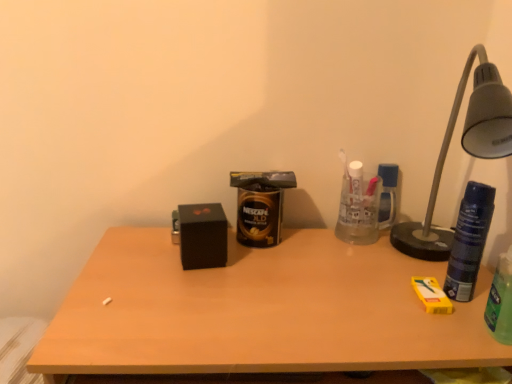
Find the location of a particular element. Image resolution: width=512 pixels, height=384 pixels. free spot to the left of gold metallic can at center, marked as the third beverage in a right-to-left arrangement is located at coordinates (155, 250).